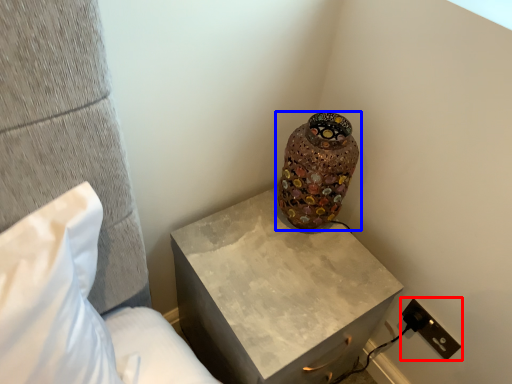
Question: Which object is closer to the camera taking this photo, electric outlet (highlighted by a red box) or vase (highlighted by a blue box)?

Choices:
 (A) electric outlet
 (B) vase

Answer: (B)